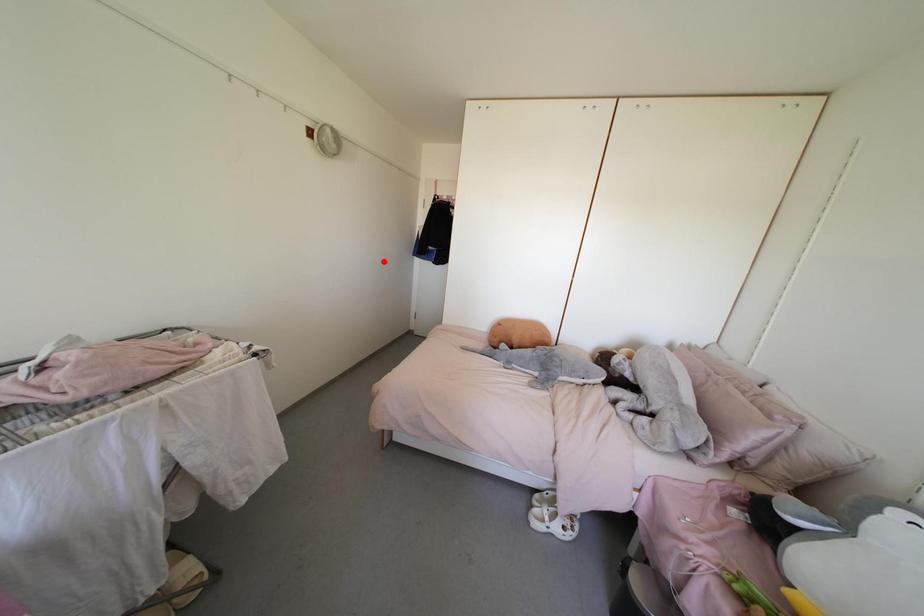
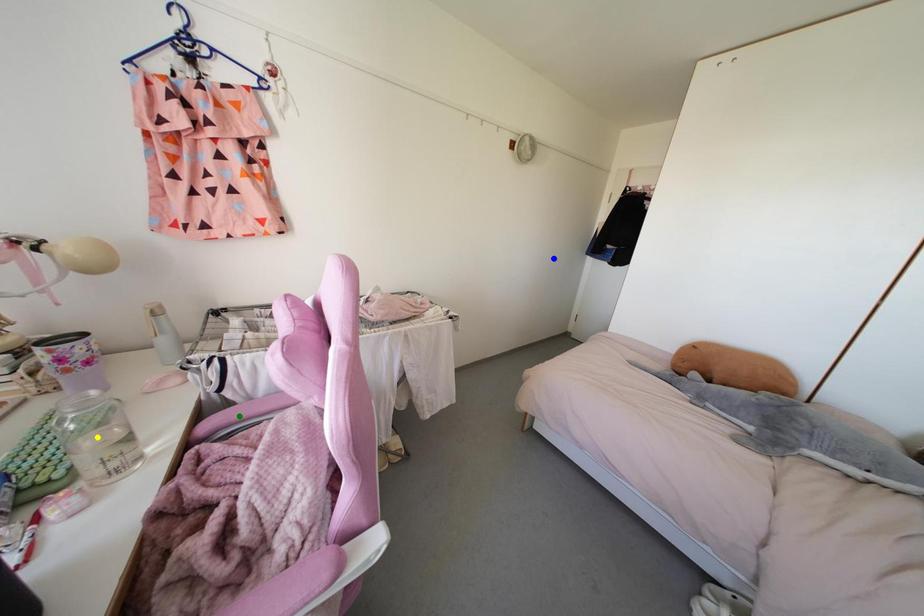
Question: I am providing you with two images of the same scene from different viewpoints. A red point is marked on the first image. You are given multiple points on the second image. Which mark in image 2 goes with the point in image 1?

Choices:
 (A) green point
 (B) yellow point
 (C) blue point

Answer: (C)